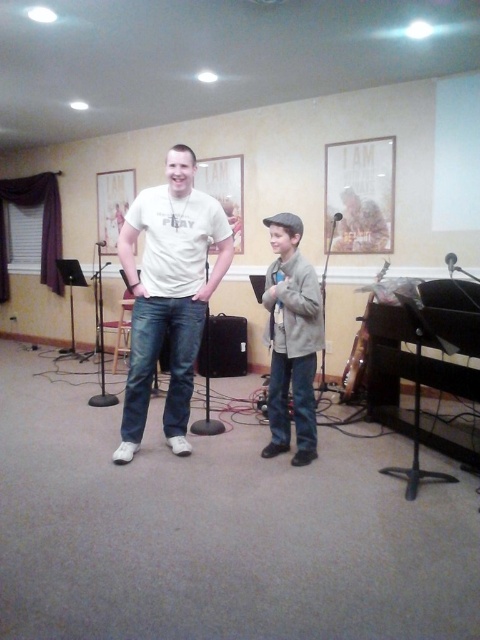
Question: Is metallic black microphone at center positioned in front of black matte microphone at center?

Choices:
 (A) yes
 (B) no

Answer: (A)

Question: Among these objects, which one is farthest from the camera?

Choices:
 (A) white matte t-shirt at center
 (B) black plastic microphone at center
 (C) black plastic speaker at center

Answer: (C)

Question: Which object appears farthest from the camera in this image?

Choices:
 (A) white matte t-shirt at center
 (B) black plastic microphone at center
 (C) metallic black microphone at center

Answer: (C)

Question: Can you confirm if white matte t-shirt at center is positioned to the left of black plastic microphone at center?

Choices:
 (A) no
 (B) yes

Answer: (B)

Question: Which point appears farthest from the camera in this image?

Choices:
 (A) (338, 218)
 (B) (97, 244)

Answer: (B)

Question: In this image, where is light brown leather jacket at center located relative to metallic black microphone at center?

Choices:
 (A) above
 (B) below

Answer: (B)